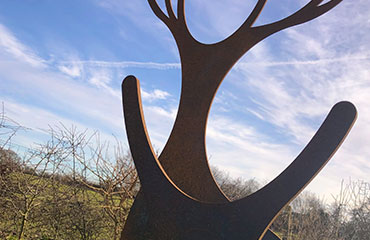
Identify the location of phone wire. (15, 143), (11, 147).